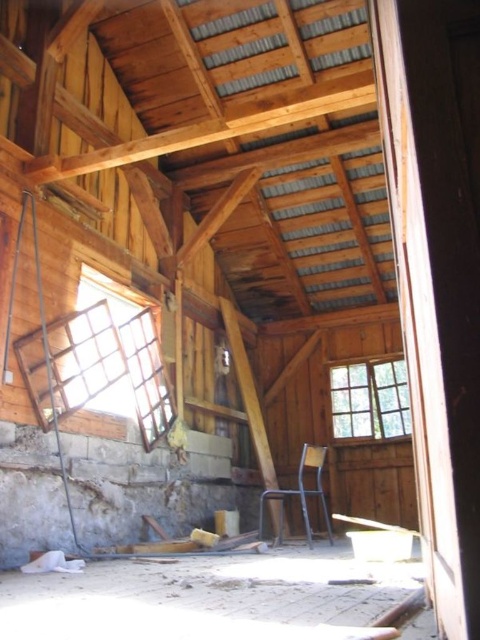
You are a contractor assessing the structural integrity of the building. You notice two clear glass windows in the scene. Which window, the clear glass window at upper left or the clear glass window at right, has a greater height?

The clear glass window at upper left is taller than the clear glass window at right, so the clear glass window at upper left has a greater height.

You are standing inside the old barn and looking at the large window with a grid pattern on the left side. There is a point marked at coordinates (x=110, y=362). Is this point located on the clear glass portion of the window?

Yes, the point (x=110, y=362) is on the clear glass window at upper left, so it is located on the clear glass portion.

From the picture: You are standing inside the rustic wooden structure and want to exit through the clear glass window at right. However, there is a metallic chair at center in your path. Can you move the chair to reach the window?

The metallic chair at center is behind the clear glass window at right, so you can reach the window without moving the chair first.